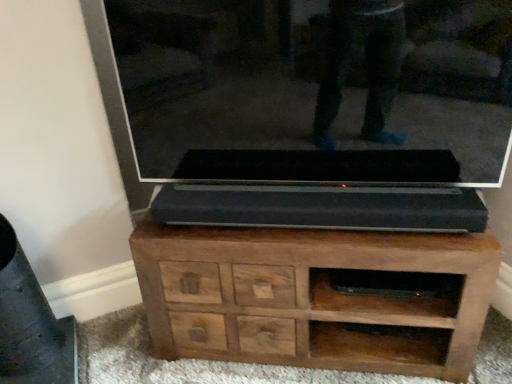
Question: Can we say brown wood chest of drawers at center lies outside transparent glass tv at center?

Choices:
 (A) no
 (B) yes

Answer: (B)

Question: Is brown wood chest of drawers at center looking in the opposite direction of transparent glass tv at center?

Choices:
 (A) no
 (B) yes

Answer: (A)

Question: Is brown wood chest of drawers at center facing towards transparent glass tv at center?

Choices:
 (A) no
 (B) yes

Answer: (A)

Question: Does brown wood chest of drawers at center have a greater height compared to transparent glass tv at center?

Choices:
 (A) no
 (B) yes

Answer: (A)

Question: From the image's perspective, is brown wood chest of drawers at center above transparent glass tv at center?

Choices:
 (A) yes
 (B) no

Answer: (B)

Question: Is brown wood chest of drawers at center positioned far away from transparent glass tv at center?

Choices:
 (A) yes
 (B) no

Answer: (B)

Question: From the image's perspective, would you say transparent glass tv at center is shown under brown wood chest of drawers at center?

Choices:
 (A) no
 (B) yes

Answer: (A)

Question: From a real-world perspective, is transparent glass tv at center positioned under brown wood chest of drawers at center based on gravity?

Choices:
 (A) no
 (B) yes

Answer: (A)

Question: Does transparent glass tv at center appear on the right side of brown wood chest of drawers at center?

Choices:
 (A) no
 (B) yes

Answer: (A)

Question: Is transparent glass tv at center looking in the opposite direction of brown wood chest of drawers at center?

Choices:
 (A) yes
 (B) no

Answer: (B)

Question: Is transparent glass tv at center shorter than brown wood chest of drawers at center?

Choices:
 (A) yes
 (B) no

Answer: (B)

Question: Can you confirm if transparent glass tv at center is taller than brown wood chest of drawers at center?

Choices:
 (A) yes
 (B) no

Answer: (A)

Question: From a real-world perspective, is transparent glass tv at center physically located above or below brown wood chest of drawers at center?

Choices:
 (A) above
 (B) below

Answer: (A)